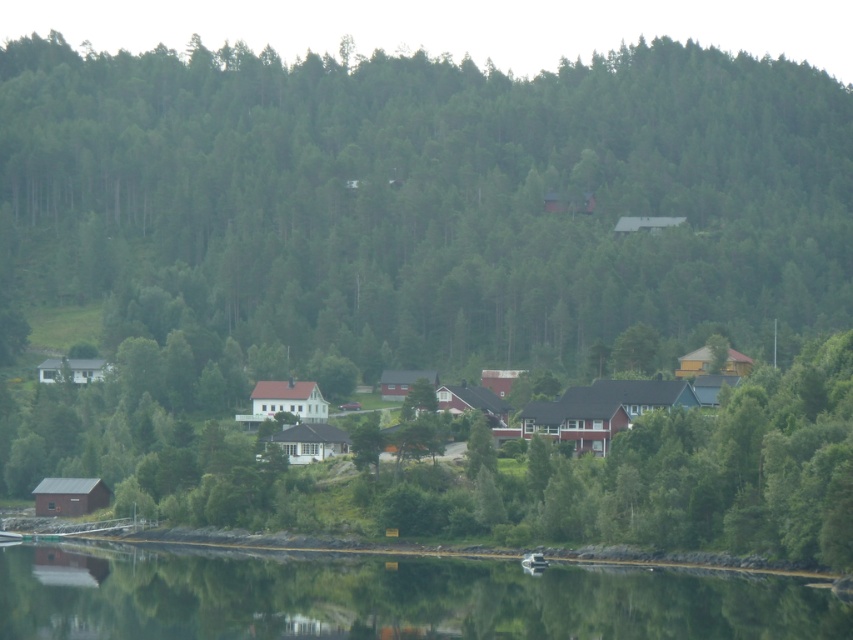
You are standing at the lakeside and see the green matte tree at center and the white matte house at center. Which one is positioned to the left?

The green matte tree at center is to the left of the white matte house at center.

You are standing at the lakeside and want to take a photo of the green matte tree at center and the transparent water at lower center. Which object appears wider in the photo?

The green matte tree at center appears wider in the photo because its width is larger than the transparent water at lower center according to the description.

You are standing at the edge of the lakeside village and want to find the transparent water at lower center. According to the map coordinates provided, where exactly should you look?

The transparent water at lower center is located at point (389, 598), so you should look towards that coordinate to find it.